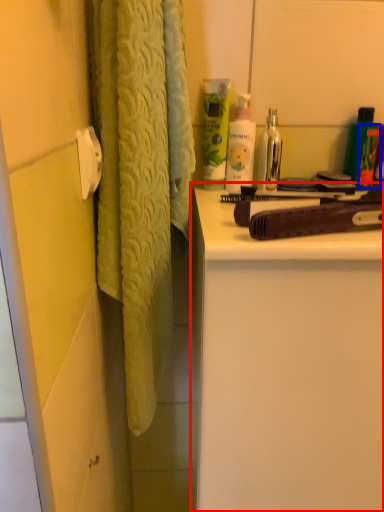
Question: Which object is closer to the camera taking this photo, bathroom cabinet (highlighted by a red box) or toiletry (highlighted by a blue box)?

Choices:
 (A) bathroom cabinet
 (B) toiletry

Answer: (A)